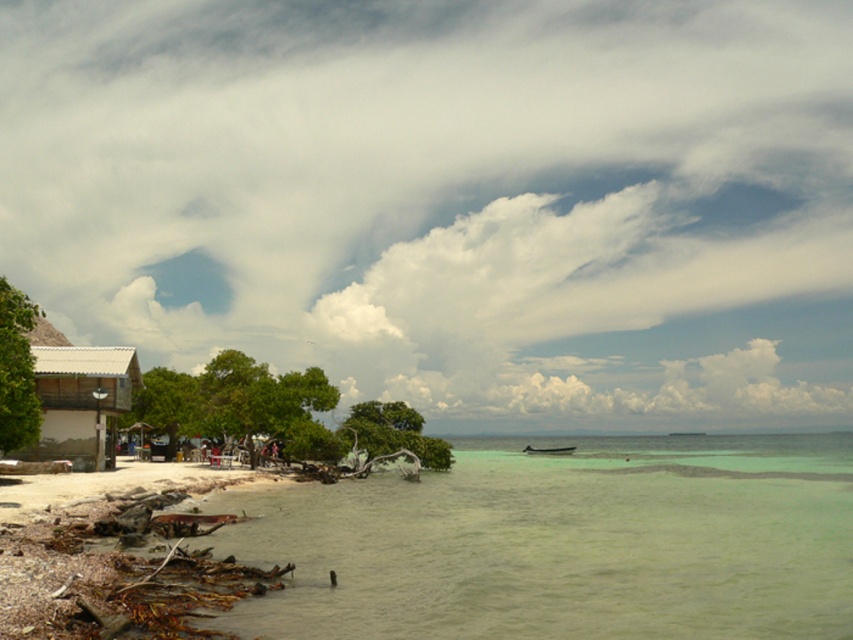
You are standing at the beach and want to take a photo of both the small boat and the thatched roof hut. You notice two points marked on your map at coordinates point (693,349) and point (546,449). Which point should you stand at to ensure both the small boat and the thatched roof hut are in your field of view?

You should stand at point (693,349) because it is closer to the camera, allowing you to see both the small boat and the thatched roof hut in your field of view.

You are standing at the beach looking towards the thatched roof hut. There are two points marked on the sand. One is at coordinate point (100, 413) and the other is at point (544, 449). Which point is closer to you as you face the hut?

The point at coordinate (100, 413) is closer to you because it is in front of point (544, 449) when facing the hut.